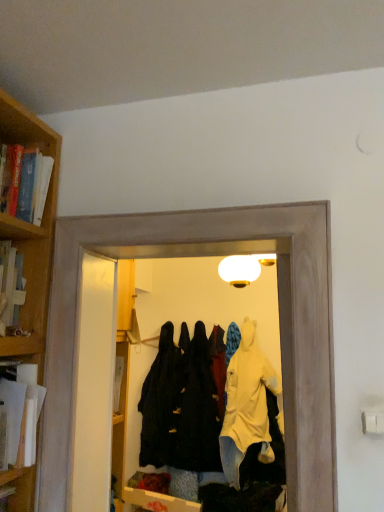
What do you see at coordinates (279, 323) in the screenshot? I see `transparent plastic coat hanger at center` at bounding box center [279, 323].

Find the location of `dark matte coat at center, marked as the 3th clothing in a back-to-front arrangement`. dark matte coat at center, marked as the 3th clothing in a back-to-front arrangement is located at coordinates (236, 417).

Describe the element at coordinates (236, 417) in the screenshot. I see `dark matte coat at center, which is the 1th clothing from front to back` at that location.

Locate an element on the screen. The height and width of the screenshot is (512, 384). white paper at left, which appears as the 2th book when viewed from the top is located at coordinates (20, 416).

Who is more distant, black matte coat at center, which is the 1th clothing from back to front, or yellow matte raincoat at center, which is counted as the second clothing, starting from the front?

black matte coat at center, which is the 1th clothing from back to front, is further from the camera.

Is black matte coat at center, the third clothing viewed from the front, to the right of yellow matte raincoat at center, the 2th clothing from the back, from the viewer's perspective?

Incorrect, black matte coat at center, the third clothing viewed from the front, is not on the right side of yellow matte raincoat at center, the 2th clothing from the back.

Who is bigger, black matte coat at center, which is the 1th clothing from back to front, or yellow matte raincoat at center, the 2th clothing from the back?

yellow matte raincoat at center, the 2th clothing from the back.

From the image's perspective, is hardcover book at left, the 1th book in the top-to-bottom sequence, located beneath transparent plastic coat hanger at center?

No.

Is the position of hardcover book at left, the 1th book in the top-to-bottom sequence, less distant than that of transparent plastic coat hanger at center?

No, it is not.

Consider the image. Between hardcover book at left, which is the 2th book from bottom to top, and transparent plastic coat hanger at center, which one has smaller width?

transparent plastic coat hanger at center is thinner.

Visually, is hardcover book at left, the 1th book in the top-to-bottom sequence, positioned to the left or to the right of transparent plastic coat hanger at center?

Based on their positions, hardcover book at left, the 1th book in the top-to-bottom sequence, is located to the left of transparent plastic coat hanger at center.

Based on the photo, from a real-world perspective, between dark matte coat at center, which is the 1th clothing from front to back, and transparent plastic coat hanger at center, who is vertically higher?

transparent plastic coat hanger at center.

Is dark matte coat at center, which is the 1th clothing from front to back, completely or partially outside of transparent plastic coat hanger at center?

Answer: Indeed, dark matte coat at center, which is the 1th clothing from front to back, is completely outside transparent plastic coat hanger at center.

Based on the photo, between dark matte coat at center, marked as the 3th clothing in a back-to-front arrangement, and transparent plastic coat hanger at center, which one has smaller width?

Thinner between the two is dark matte coat at center, marked as the 3th clothing in a back-to-front arrangement.

Between dark matte coat at center, marked as the 3th clothing in a back-to-front arrangement, and transparent plastic coat hanger at center, which one has smaller size?

With smaller size is dark matte coat at center, marked as the 3th clothing in a back-to-front arrangement.

Is yellow matte raincoat at center, the 2th clothing from the back, positioned far away from transparent plastic coat hanger at center?

yellow matte raincoat at center, the 2th clothing from the back, is far away from transparent plastic coat hanger at center.

Between yellow matte raincoat at center, which is counted as the second clothing, starting from the front, and transparent plastic coat hanger at center, which one has less height?

transparent plastic coat hanger at center.

Relative to transparent plastic coat hanger at center, is yellow matte raincoat at center, the 2th clothing from the back, in front or behind?

In the image, yellow matte raincoat at center, the 2th clothing from the back, appears behind transparent plastic coat hanger at center.

Image resolution: width=384 pixels, height=512 pixels. Find the location of `the 2nd clothing to the right when counting from the transparent plastic coat hanger at center`. the 2nd clothing to the right when counting from the transparent plastic coat hanger at center is located at coordinates (247, 406).

From the picture: Visually, is black matte coat at center, which is the 1th clothing from back to front, positioned to the left or to the right of dark matte coat at center, marked as the 3th clothing in a back-to-front arrangement?

black matte coat at center, which is the 1th clothing from back to front, is to the left of dark matte coat at center, marked as the 3th clothing in a back-to-front arrangement.

From a real-world perspective, is black matte coat at center, which is the 1th clothing from back to front, on dark matte coat at center, marked as the 3th clothing in a back-to-front arrangement?

Incorrect, from a real-world perspective, black matte coat at center, which is the 1th clothing from back to front, is lower than dark matte coat at center, marked as the 3th clothing in a back-to-front arrangement.

Is black matte coat at center, the third clothing viewed from the front, oriented towards dark matte coat at center, marked as the 3th clothing in a back-to-front arrangement?

No, black matte coat at center, the third clothing viewed from the front, is not turned towards dark matte coat at center, marked as the 3th clothing in a back-to-front arrangement.

What's the angular difference between black matte coat at center, which is the 1th clothing from back to front, and white paper at left, which appears as the 2th book when viewed from the top,'s facing directions?

The angular difference between black matte coat at center, which is the 1th clothing from back to front, and white paper at left, which appears as the 2th book when viewed from the top, is 88.2 degrees.

Can white paper at left, acting as the first book starting from the bottom, be found inside black matte coat at center, the third clothing viewed from the front?

No, white paper at left, acting as the first book starting from the bottom, is not inside black matte coat at center, the third clothing viewed from the front.

Which of these two, black matte coat at center, which is the 1th clothing from back to front, or white paper at left, which appears as the 2th book when viewed from the top, stands taller?

Standing taller between the two is black matte coat at center, which is the 1th clothing from back to front.

Which of these two, black matte coat at center, which is the 1th clothing from back to front, or white paper at left, acting as the first book starting from the bottom, is thinner?

white paper at left, acting as the first book starting from the bottom, is thinner.

Which of these two, hardcover book at left, the 1th book in the top-to-bottom sequence, or dark matte coat at center, which is the 1th clothing from front to back, is bigger?

dark matte coat at center, which is the 1th clothing from front to back, is bigger.

From the image's perspective, which object appears higher, hardcover book at left, which is the 2th book from bottom to top, or dark matte coat at center, marked as the 3th clothing in a back-to-front arrangement?

hardcover book at left, which is the 2th book from bottom to top, is shown above in the image.

Which object is closer to the camera, hardcover book at left, the 1th book in the top-to-bottom sequence, or dark matte coat at center, marked as the 3th clothing in a back-to-front arrangement?

Positioned in front is hardcover book at left, the 1th book in the top-to-bottom sequence.

Considering the sizes of objects hardcover book at left, the 1th book in the top-to-bottom sequence, and dark matte coat at center, which is the 1th clothing from front to back, in the image provided, who is taller, hardcover book at left, the 1th book in the top-to-bottom sequence, or dark matte coat at center, which is the 1th clothing from front to back,?

dark matte coat at center, which is the 1th clothing from front to back.

The image size is (384, 512). I want to click on the 1st clothing positioned above the black matte coat at center, which is the 1th clothing from back to front (from the image's perspective), so click(x=247, y=406).

Where is `book above the transparent plastic coat hanger at center (from a real-world perspective)`? book above the transparent plastic coat hanger at center (from a real-world perspective) is located at coordinates (24, 182).

Considering their positions, is hardcover book at left, the 1th book in the top-to-bottom sequence, positioned further to black matte coat at center, the third clothing viewed from the front, than transparent plastic coat hanger at center?

hardcover book at left, the 1th book in the top-to-bottom sequence, is positioned further to the anchor black matte coat at center, the third clothing viewed from the front.

Based on their spatial positions, is dark matte coat at center, marked as the 3th clothing in a back-to-front arrangement, or white paper at left, acting as the first book starting from the bottom, closer to hardcover book at left, which is the 2th book from bottom to top?

white paper at left, acting as the first book starting from the bottom, is closer to hardcover book at left, which is the 2th book from bottom to top.

Estimate the real-world distances between objects in this image. Which object is closer to black matte coat at center, which is the 1th clothing from back to front, dark matte coat at center, which is the 1th clothing from front to back, or white paper at left, which appears as the 2th book when viewed from the top?

dark matte coat at center, which is the 1th clothing from front to back, is closer to black matte coat at center, which is the 1th clothing from back to front.

From the image, which object appears to be nearer to dark matte coat at center, marked as the 3th clothing in a back-to-front arrangement, black matte coat at center, which is the 1th clothing from back to front, or yellow matte raincoat at center, the 2th clothing from the back?

Among the two, yellow matte raincoat at center, the 2th clothing from the back, is located nearer to dark matte coat at center, marked as the 3th clothing in a back-to-front arrangement.

From the picture: Considering their positions, is white paper at left, which appears as the 2th book when viewed from the top, positioned closer to dark matte coat at center, marked as the 3th clothing in a back-to-front arrangement, than hardcover book at left, the 1th book in the top-to-bottom sequence?

white paper at left, which appears as the 2th book when viewed from the top, lies closer to dark matte coat at center, marked as the 3th clothing in a back-to-front arrangement, than the other object.

Considering their positions, is transparent plastic coat hanger at center positioned further to dark matte coat at center, marked as the 3th clothing in a back-to-front arrangement, than black matte coat at center, which is the 1th clothing from back to front?

The object further to dark matte coat at center, marked as the 3th clothing in a back-to-front arrangement, is transparent plastic coat hanger at center.

Looking at the image, which one is located closer to hardcover book at left, the 1th book in the top-to-bottom sequence, yellow matte raincoat at center, the 2th clothing from the back, or transparent plastic coat hanger at center?

The object closer to hardcover book at left, the 1th book in the top-to-bottom sequence, is transparent plastic coat hanger at center.

When comparing their distances from transparent plastic coat hanger at center, does black matte coat at center, which is the 1th clothing from back to front, or white paper at left, which appears as the 2th book when viewed from the top, seem further?

black matte coat at center, which is the 1th clothing from back to front.

You are a GUI agent. You are given a task and a screenshot of the screen. Output one action in this format:
    pyautogui.click(x=<x>, y=<y>)
    Task: Click on the clothing between hardcover book at left, which is the 2th book from bottom to top, and white paper at left, which appears as the 2th book when viewed from the top, from top to bottom
    This screenshot has width=384, height=512.
    Given the screenshot: What is the action you would take?
    pyautogui.click(x=236, y=417)

You are a GUI agent. You are given a task and a screenshot of the screen. Output one action in this format:
    pyautogui.click(x=<x>, y=<y>)
    Task: Click on the glass door between hardcover book at left, which is the 2th book from bottom to top, and white paper at left, which appears as the 2th book when viewed from the top, from top to bottom
    The height and width of the screenshot is (512, 384).
    Given the screenshot: What is the action you would take?
    pyautogui.click(x=279, y=323)

This screenshot has width=384, height=512. In order to click on glass door between hardcover book at left, which is the 2th book from bottom to top, and dark matte coat at center, marked as the 3th clothing in a back-to-front arrangement, from top to bottom in this screenshot , I will do `click(279, 323)`.

Identify the location of clothing between white paper at left, acting as the first book starting from the bottom, and yellow matte raincoat at center, the 2th clothing from the back, along the z-axis. Image resolution: width=384 pixels, height=512 pixels. (236, 417).